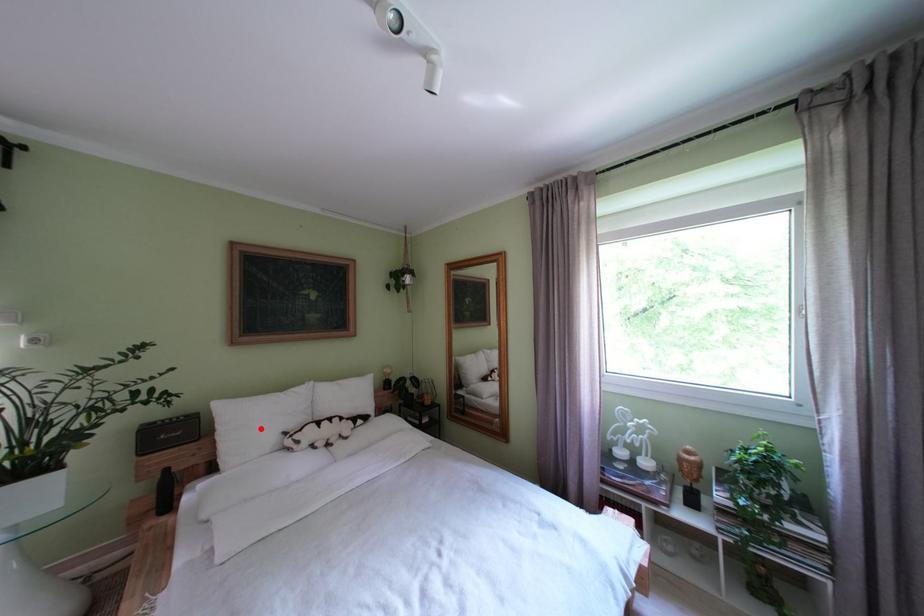
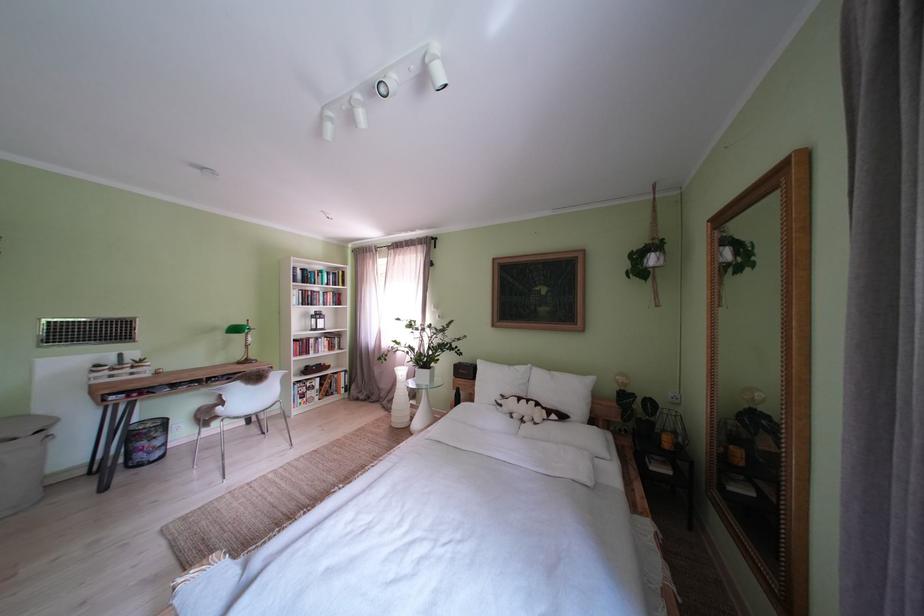
Where in the second image is the point corresponding to the highlighted location from the first image?

(500, 386)